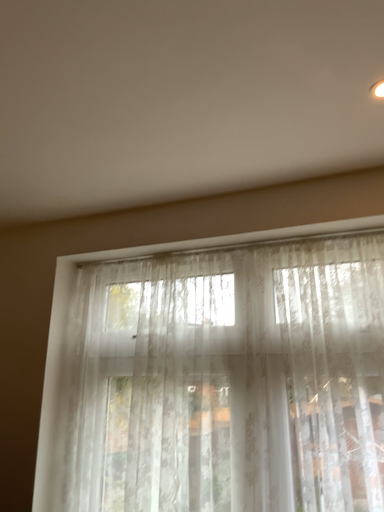
Question: From a real-world perspective, relative to white sheer curtains at lower center, is translucent lace curtain at center vertically above or below?

Choices:
 (A) below
 (B) above

Answer: (A)

Question: From their relative heights in the image, would you say translucent lace curtain at center is taller or shorter than white sheer curtains at lower center?

Choices:
 (A) tall
 (B) short

Answer: (A)

Question: Considering the positions of translucent lace curtain at center and white sheer curtains at lower center in the image, is translucent lace curtain at center bigger or smaller than white sheer curtains at lower center?

Choices:
 (A) small
 (B) big

Answer: (A)

Question: Considering their positions, is white sheer curtains at lower center located in front of or behind translucent lace curtain at center?

Choices:
 (A) front
 (B) behind

Answer: (A)

Question: Considering the positions of white sheer curtains at lower center and translucent lace curtain at center in the image, is white sheer curtains at lower center wider or thinner than translucent lace curtain at center?

Choices:
 (A) wide
 (B) thin

Answer: (A)

Question: Considering the positions of point (241, 17) and point (271, 414), is point (241, 17) closer or farther from the camera than point (271, 414)?

Choices:
 (A) closer
 (B) farther

Answer: (A)

Question: Is white sheer curtains at lower center taller or shorter than translucent lace curtain at center?

Choices:
 (A) tall
 (B) short

Answer: (B)